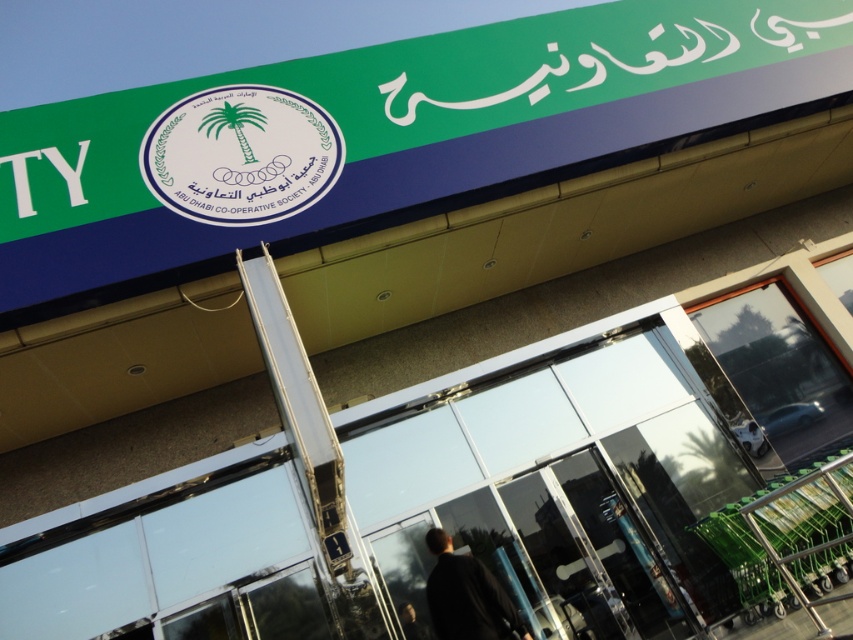
Question: Does green plastic signboard at upper center lie behind white glossy emblem at center?

Choices:
 (A) no
 (B) yes

Answer: (A)

Question: Can you confirm if green plastic signboard at upper center is thinner than black matte jacket at lower center?

Choices:
 (A) no
 (B) yes

Answer: (B)

Question: Which object is the closest to the green plastic signboard at upper center?

Choices:
 (A) white glossy emblem at center
 (B) black matte jacket at lower center

Answer: (A)

Question: Is white glossy emblem at center to the left of black matte jacket at lower center from the viewer's perspective?

Choices:
 (A) no
 (B) yes

Answer: (B)

Question: Which object appears closest to the camera in this image?

Choices:
 (A) black matte jacket at lower center
 (B) green plastic signboard at upper center
 (C) white glossy emblem at center

Answer: (A)

Question: Which point appears closest to the camera in this image?

Choices:
 (A) (440, 611)
 (B) (712, 36)
 (C) (190, 141)

Answer: (A)